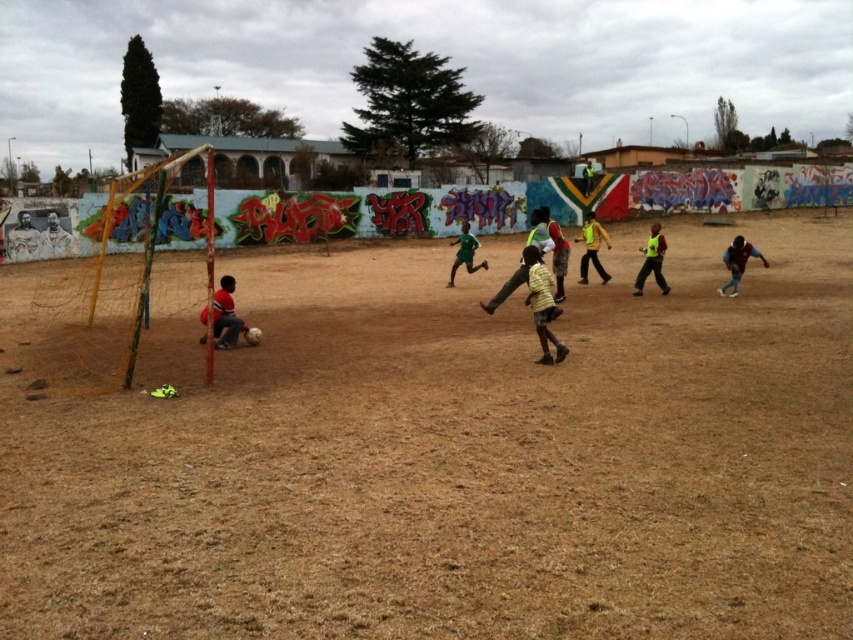
Question: Which point is closer to the camera taking this photo?

Choices:
 (A) [x=213, y=344]
 (B) [x=780, y=627]
 (C) [x=605, y=234]

Answer: (B)

Question: Can you confirm if yellow matte vest at center is thinner than yellow reflective vest at center?

Choices:
 (A) yes
 (B) no

Answer: (A)

Question: Is brown dry grass at center above maroon jersey at right?

Choices:
 (A) no
 (B) yes

Answer: (A)

Question: Which of the following is the closest to the observer?

Choices:
 (A) 16,438
 (B) 763,257
 (C) 578,237

Answer: (A)

Question: Does brown dry grass at center appear on the left side of green matte shirt at center?

Choices:
 (A) yes
 (B) no

Answer: (A)

Question: Which object is the farthest from the yellow reflective vest at center?

Choices:
 (A) yellow matte vest at center
 (B) red cotton shirt at lower left
 (C) green matte shirt at center

Answer: (B)